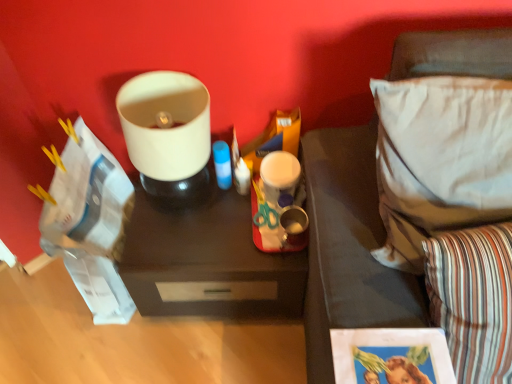
This screenshot has width=512, height=384. Identify the location of vacant region under matte white lampshade at upper center (from a real-world perspective). (184, 206).